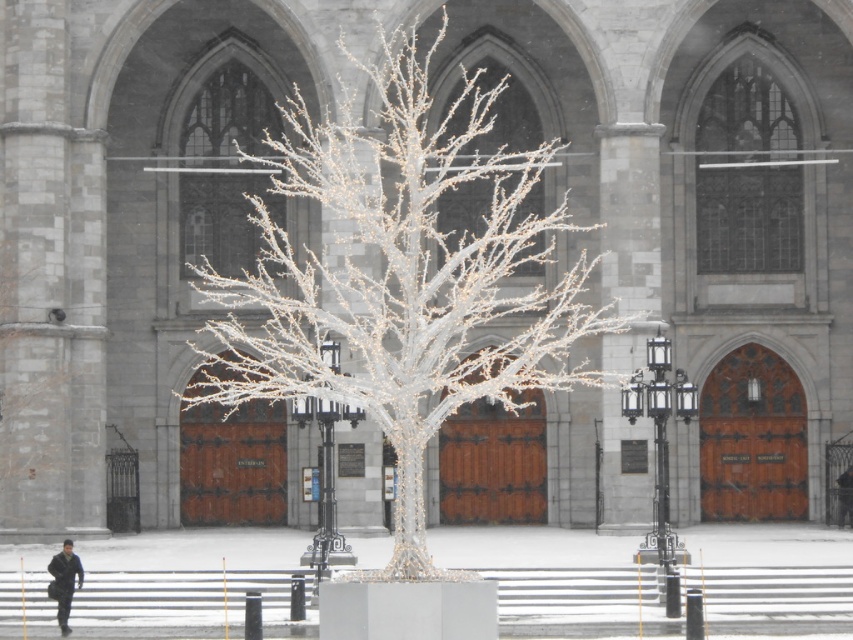
Who is positioned more to the right, icy white branches at center or dark blue uniform at lower left?

Positioned to the right is icy white branches at center.

Which of these two, icy white branches at center or dark blue uniform at lower left, stands shorter?

dark blue uniform at lower left

Who is more forward, (409, 40) or (57, 595)?

Point (57, 595) is in front.

Locate an element on the screen. The width and height of the screenshot is (853, 640). icy white branches at center is located at coordinates (401, 276).